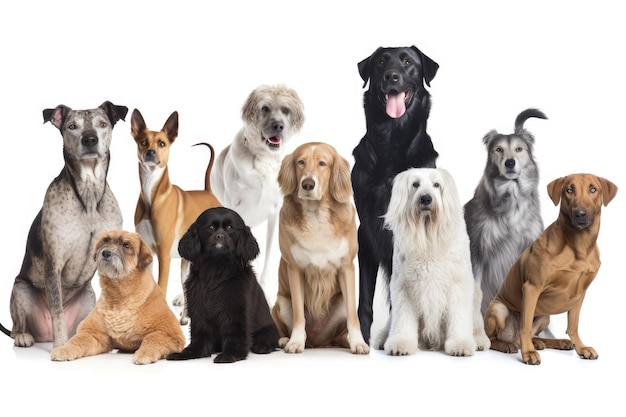
Locate an element on the screen. The height and width of the screenshot is (417, 626). the chest is located at coordinates (79, 252), (145, 226), (124, 325), (210, 306), (332, 241), (260, 180), (434, 260), (371, 189), (501, 231), (570, 280).